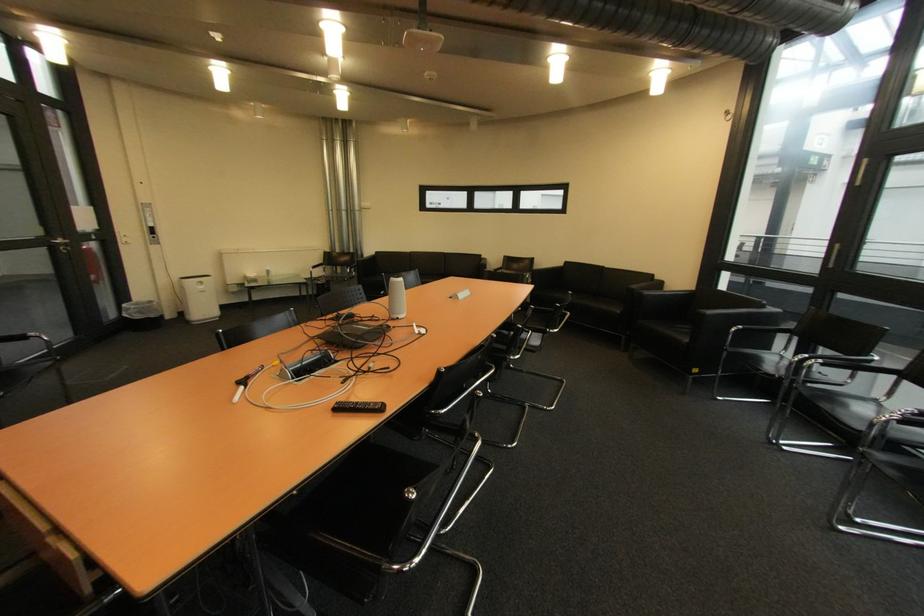
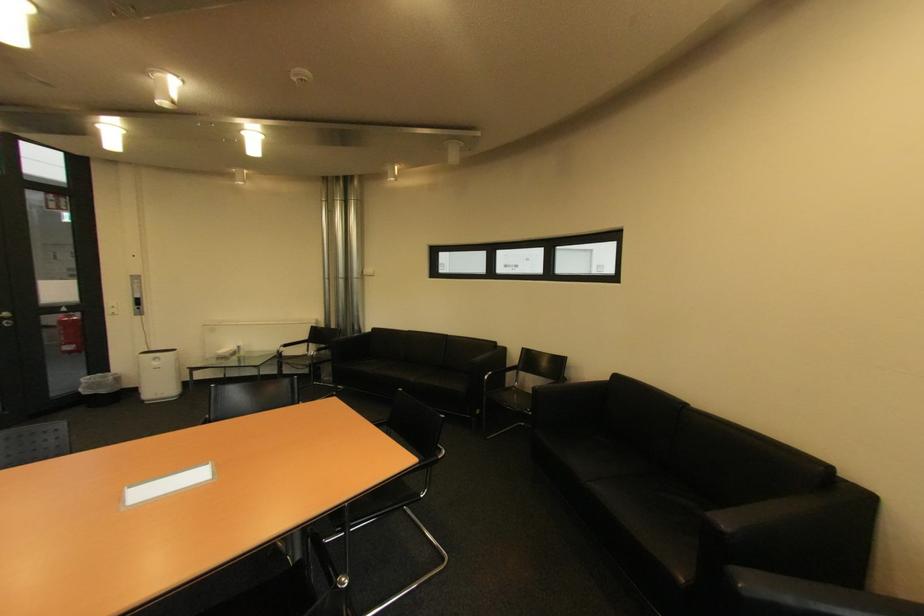
Find the pixel in the second image that matches (68,241) in the first image.

(14, 315)